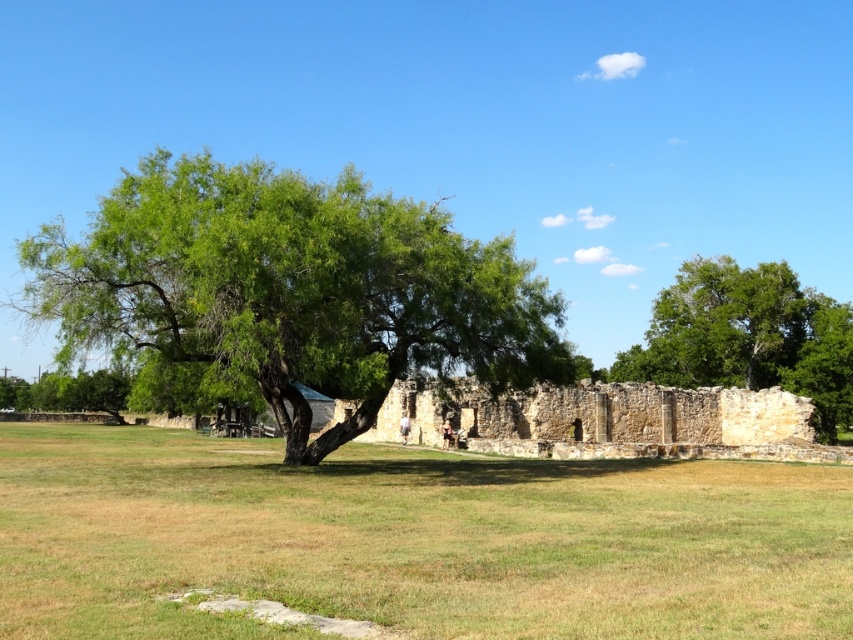
Question: In this image, where is stone ruins at center located relative to green leafy tree at right?

Choices:
 (A) above
 (B) below

Answer: (B)

Question: Which of the following is the closest to the observer?

Choices:
 (A) (642, 536)
 (B) (744, 410)
 (C) (724, 353)

Answer: (A)

Question: Among these points, which one is farthest from the camera?

Choices:
 (A) (811, 563)
 (B) (289, 442)
 (C) (598, 422)

Answer: (C)

Question: Is green grass at center thinner than green leafy tree at center?

Choices:
 (A) yes
 (B) no

Answer: (B)

Question: In this image, where is green grass at center located relative to stone ruins at center?

Choices:
 (A) below
 (B) above

Answer: (A)

Question: Among these objects, which one is nearest to the camera?

Choices:
 (A) stone ruins at center
 (B) green grass at center
 (C) green leafy tree at right

Answer: (B)